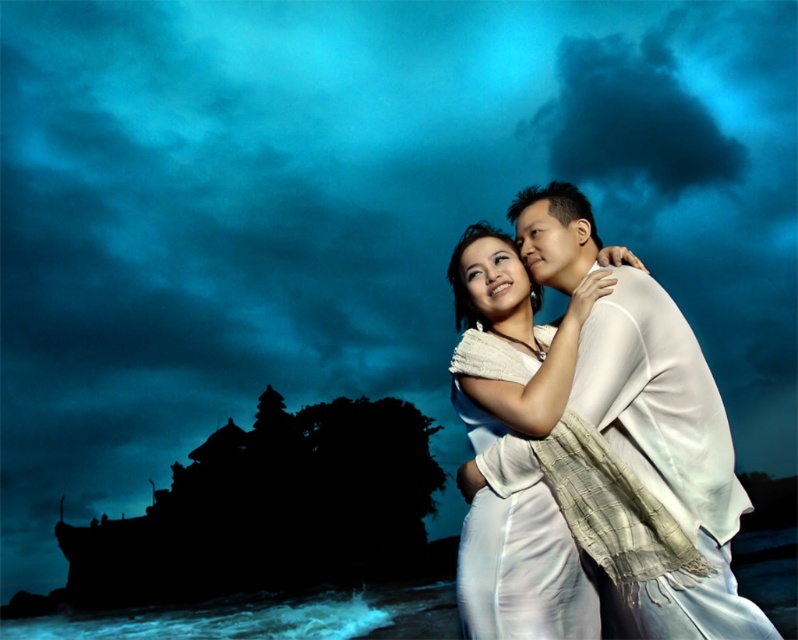
You are standing at the point labeled point (551, 273) and want to take a photo of the two people in the romantic scene. The camera you are using has a focal length of 50mm and requires the subject to be within 200 feet to capture clearly. Will you be able to take a clear photo of the two people from your current position?

The point labeled point (551, 273) and the camera are 188.70 feet apart from each other. Since 188.70 feet is within the 200 feet range required by the camera, you can take a clear photo of the two people from your current position.

Looking at this image, you are a photographer standing at a safe distance to capture the perfect shot of the white sheer fabric couple at center. According to the scene description, what is the minimum distance you should maintain to ensure their safety?

The white sheer fabric couple at center are 134.39 feet away from the viewer, so the photographer should maintain a minimum distance of at least 134.39 feet to ensure their safety.